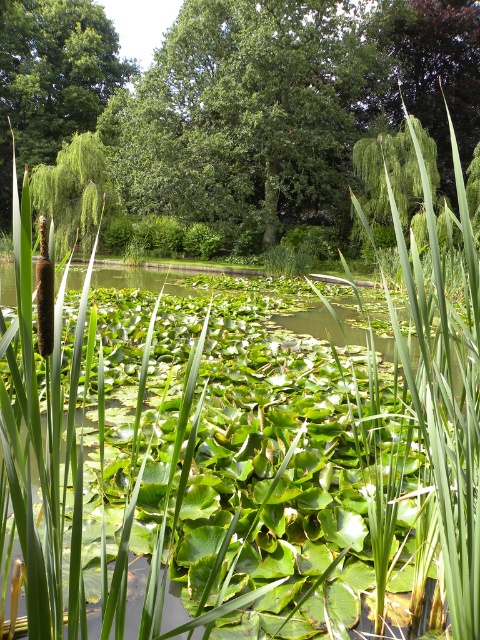
Question: Does green leafy tree at center appear over green leafy tree at left?

Choices:
 (A) no
 (B) yes

Answer: (A)

Question: Is green leafy tree at center smaller than green leafy tree at left?

Choices:
 (A) yes
 (B) no

Answer: (B)

Question: Which point is closer to the camera?

Choices:
 (A) green leafy tree at left
 (B) green leafy tree at center

Answer: (B)

Question: Among these points, which one is nearest to the camera?

Choices:
 (A) click(x=203, y=19)
 (B) click(x=1, y=106)

Answer: (A)

Question: Can you confirm if green leafy tree at center is positioned to the right of green leafy tree at left?

Choices:
 (A) yes
 (B) no

Answer: (A)

Question: Which point is closer to the camera taking this photo?

Choices:
 (A) (33, 74)
 (B) (240, 33)

Answer: (B)